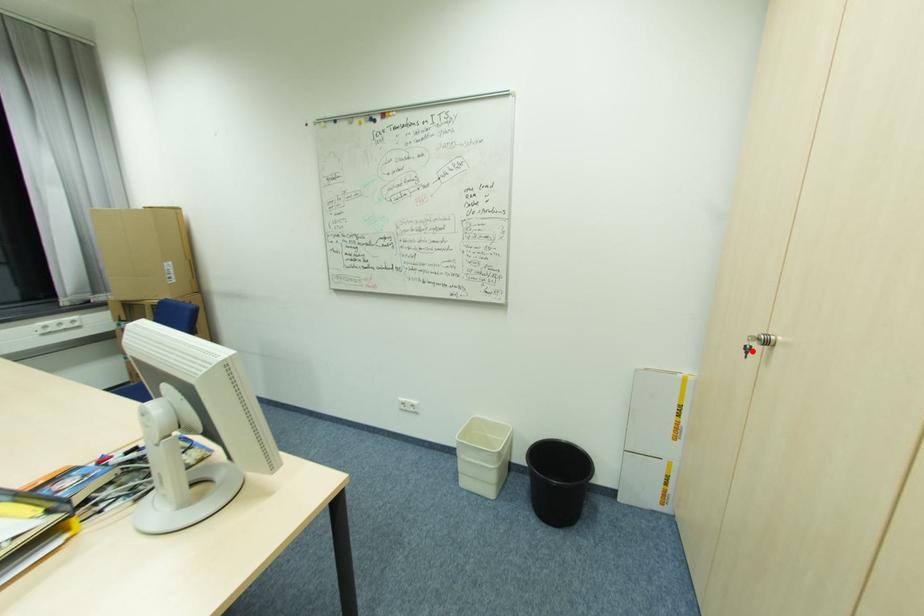
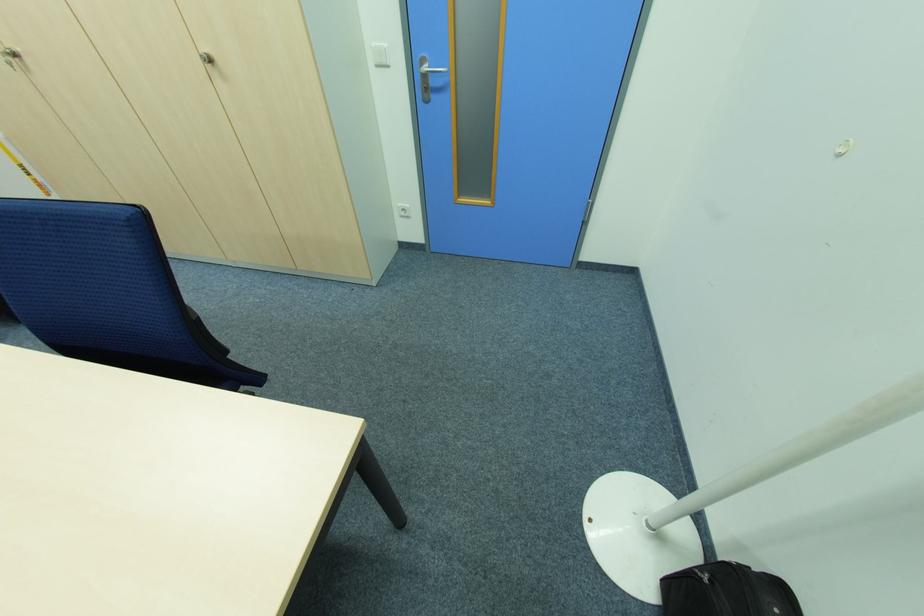
Where in the second image is the point corresponding to the highlighted location from the first image?

(14, 65)